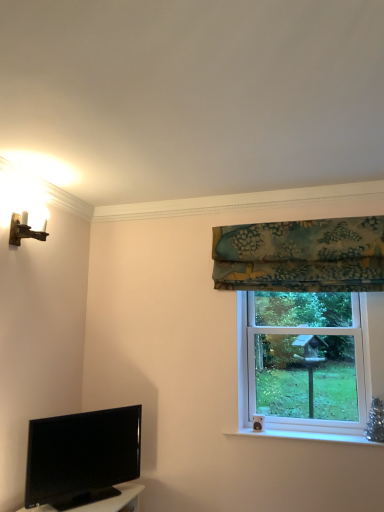
Question: Is teal floral fabric at upper right wider or thinner than black glossy tv at lower left?

Choices:
 (A) thin
 (B) wide

Answer: (B)

Question: Visually, is teal floral fabric at upper right positioned to the left or to the right of black glossy tv at lower left?

Choices:
 (A) left
 (B) right

Answer: (B)

Question: Considering the real-world distances, which object is farthest from the wooden wall sconce at upper left?

Choices:
 (A) clear glass window at right
 (B) teal floral fabric at upper right
 (C) black glossy tv at lower left

Answer: (A)

Question: Estimate the real-world distances between objects in this image. Which object is closer to the clear glass window at right?

Choices:
 (A) teal floral fabric at upper right
 (B) black glossy tv at lower left
 (C) wooden wall sconce at upper left

Answer: (A)